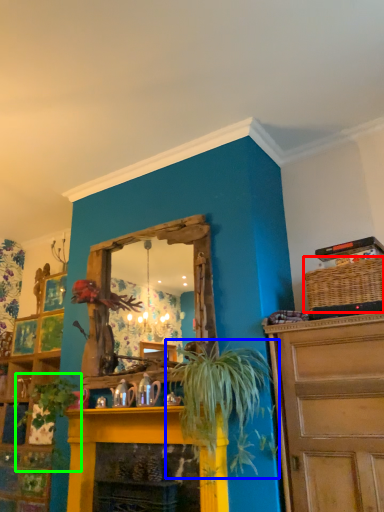
Question: Which is farther away from basket (highlighted by a red box)? houseplant (highlighted by a blue box) or plant (highlighted by a green box)?

Choices:
 (A) houseplant
 (B) plant

Answer: (B)